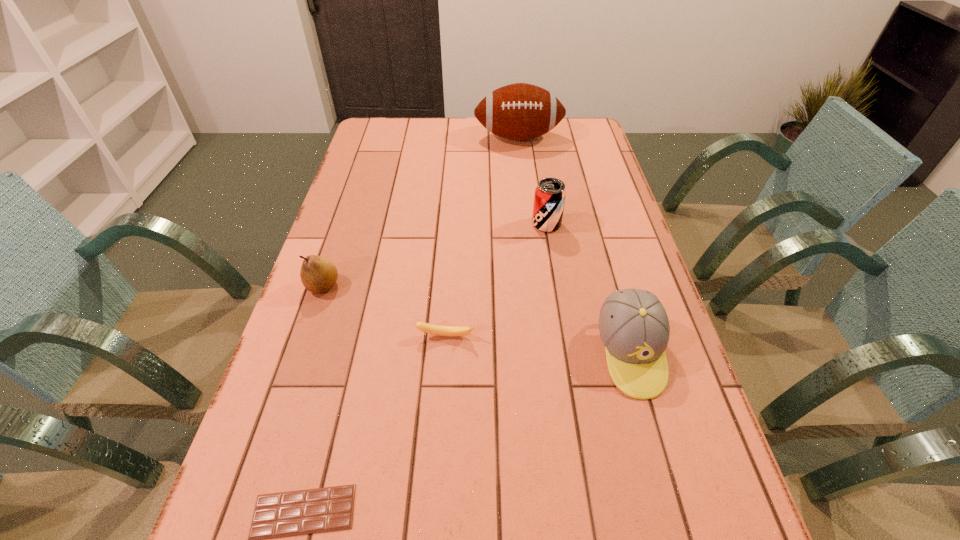
Image resolution: width=960 pixels, height=540 pixels. In order to click on free space located 0.380m at the stem of the second shortest object in this screenshot , I will do `click(434, 524)`.

Find the location of a particular element. The width and height of the screenshot is (960, 540). object that is at the far edge is located at coordinates (520, 111).

Find the location of `object present at the left edge`. object present at the left edge is located at coordinates pos(318,274).

You are a GUI agent. You are given a task and a screenshot of the screen. Output one action in this format:
    pyautogui.click(x=<x>, y=<y>)
    Task: Click on the football located at the right edge
    The width and height of the screenshot is (960, 540).
    Given the screenshot: What is the action you would take?
    pyautogui.click(x=520, y=111)

At what (x,y) coordinates should I click in order to perform the action: click on baseball cap that is positioned at the right edge. Please return your answer as a coordinate pair (x, y). This screenshot has height=540, width=960. Looking at the image, I should click on (634, 327).

Where is `object located in the far right corner section of the desktop`? The height and width of the screenshot is (540, 960). object located in the far right corner section of the desktop is located at coordinates (520, 111).

In the image, there is a desktop. At what (x,y) coordinates should I click in order to perform the action: click on vacant space at the far edge. Please return your answer as a coordinate pair (x, y). Image resolution: width=960 pixels, height=540 pixels. Looking at the image, I should click on (477, 143).

The image size is (960, 540). In order to click on vacant space at the left edge of the desktop in this screenshot , I will do `click(349, 236)`.

The height and width of the screenshot is (540, 960). I want to click on vacant space at the right edge of the desktop, so click(x=666, y=437).

In the image, there is a desktop. At what (x,y) coordinates should I click in order to perform the action: click on vacant space at the far left corner. Please return your answer as a coordinate pair (x, y). This screenshot has width=960, height=540. Looking at the image, I should click on (389, 119).